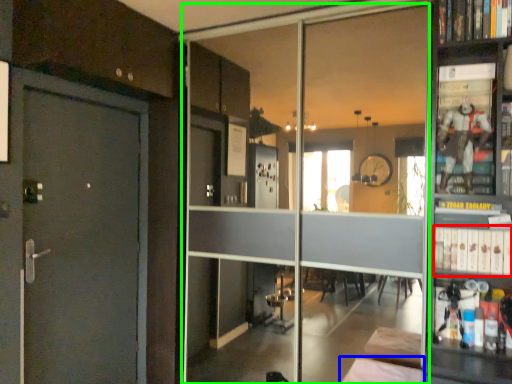
Question: Which object is positioned farthest from book (highlighted by a red box)? Select from furniture (highlighted by a blue box) and glass door (highlighted by a green box).

Choices:
 (A) furniture
 (B) glass door

Answer: (B)